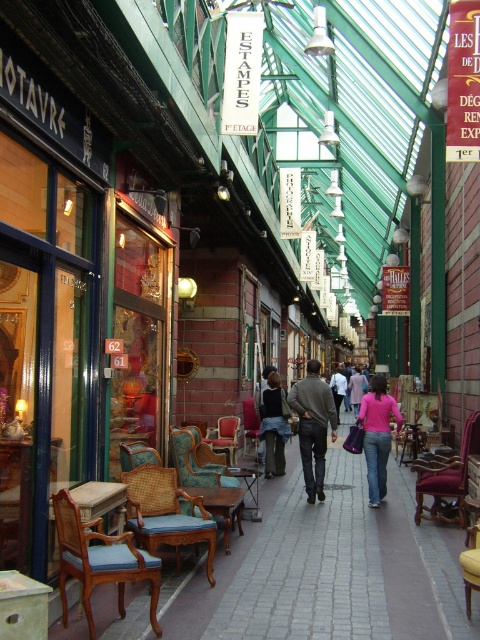
Question: Where is wooden armchair at left located in relation to yellow fabric armchair at center in the image?

Choices:
 (A) left
 (B) right

Answer: (A)

Question: Considering the relative positions of velvet burgundy armchair at center and yellow fabric armchair at center in the image provided, where is velvet burgundy armchair at center located with respect to yellow fabric armchair at center?

Choices:
 (A) left
 (B) right

Answer: (B)

Question: Among these objects, which one is nearest to the camera?

Choices:
 (A) wooden furniture at center
 (B) gray wool sweater at center
 (C) yellow fabric armchair at center
 (D) teal fabric armchair at center

Answer: (C)

Question: Which point is closer to the camera taking this photo?

Choices:
 (A) (231, 449)
 (B) (450, 468)
 (C) (381, 474)
 (D) (218, 499)

Answer: (D)

Question: Which point is closer to the camera?

Choices:
 (A) wooden furniture at center
 (B) light brown leather jacket at center

Answer: (A)

Question: Is wooden armchair at center below teal fabric armchair at center?

Choices:
 (A) yes
 (B) no

Answer: (A)